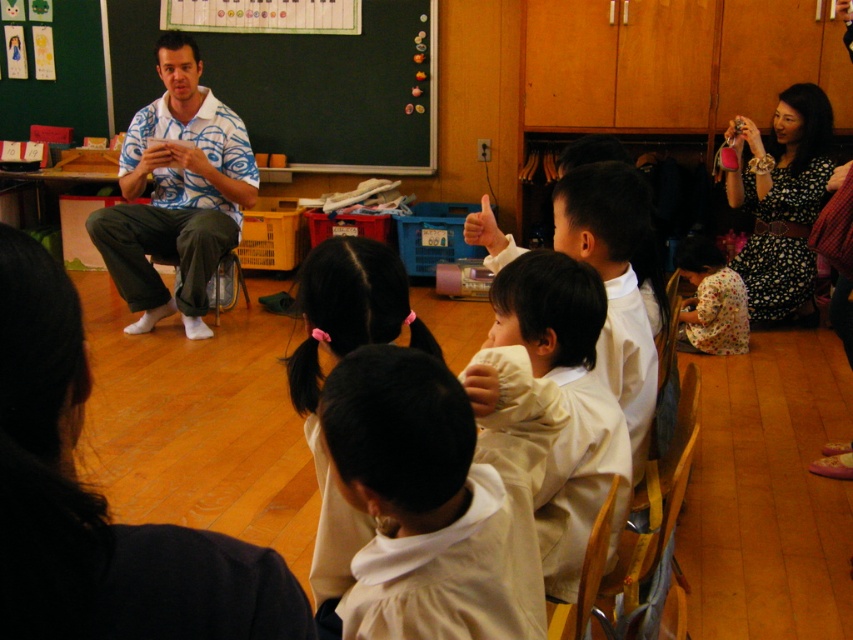
Is point (236, 22) behind point (148, 160)?

Yes, it is behind point (148, 160).

Is point (238, 26) farther from camera compared to point (216, 104)?

Yes, it is behind point (216, 104).

Identify the location of green chalkboard at upper center. This screenshot has width=853, height=640. (299, 76).

How far apart are white fabric at center and black dotted dress at upper right?

They are 3.80 meters apart.

Is point (517, 529) more distant than point (776, 193)?

No, (517, 529) is closer to viewer.

Which is in front, point (502, 484) or point (776, 202)?

Point (502, 484) is more forward.

Where is `white fabric at center`? white fabric at center is located at coordinates (439, 496).

Which of these two, white fabric at center or green chalkboard at upper center, stands shorter?

white fabric at center is shorter.

Does point (412, 349) come behind point (264, 134)?

No, it is not.

Describe the element at coordinates (439, 496) in the screenshot. The height and width of the screenshot is (640, 853). I see `white fabric at center` at that location.

I want to click on white fabric at center, so click(439, 496).